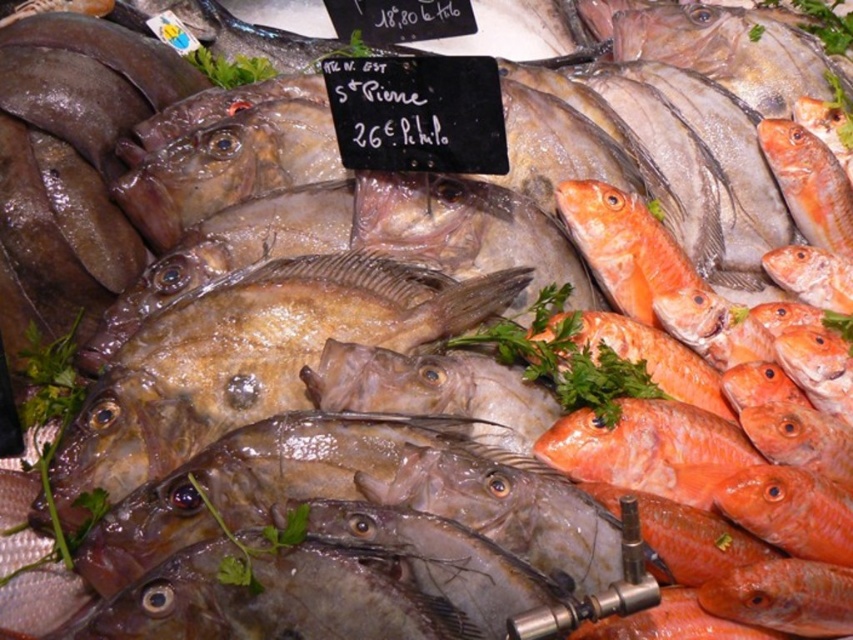
Does shiny orange fish at center have a lesser height compared to green leafy parsley at center?

No, shiny orange fish at center is not shorter than green leafy parsley at center.

Who is shorter, shiny orange fish at center or green leafy parsley at center?

green leafy parsley at center is shorter.

What do you see at coordinates (627, 248) in the screenshot? I see `shiny orange fish at center` at bounding box center [627, 248].

Identify the location of shiny orange fish at center. (627, 248).